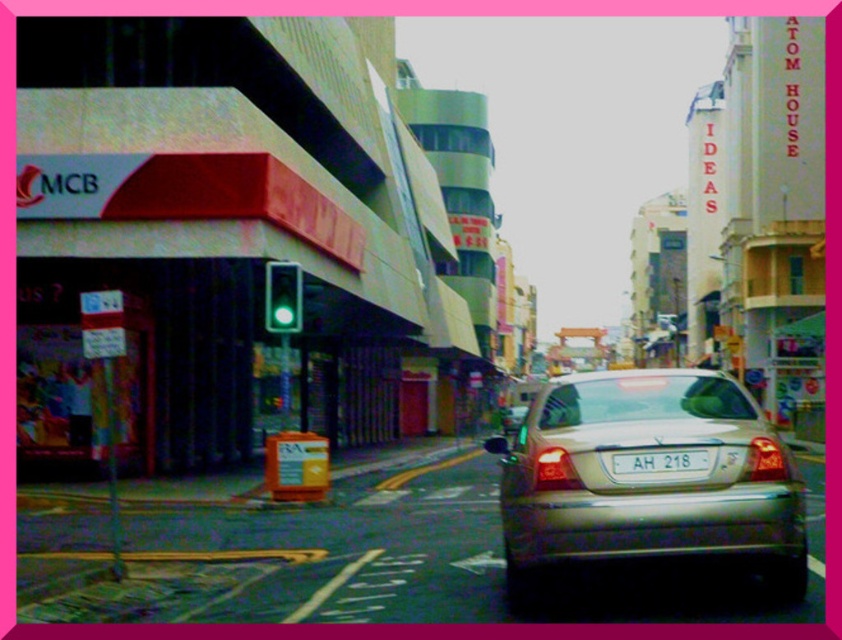
Question: Is silver metallic car at center below white plastic license plate at center?

Choices:
 (A) no
 (B) yes

Answer: (B)

Question: Is the position of silver metallic car at center less distant than that of white plastic license plate at center?

Choices:
 (A) no
 (B) yes

Answer: (B)

Question: Which point is farther from the camera taking this photo?

Choices:
 (A) (632, 376)
 (B) (270, 324)
 (C) (619, 474)

Answer: (B)

Question: Which point is closer to the camera?

Choices:
 (A) (784, 573)
 (B) (270, 317)
 (C) (681, 468)

Answer: (C)

Question: Can you confirm if silver metallic car at center is positioned to the right of white plastic license plate at center?

Choices:
 (A) no
 (B) yes

Answer: (A)

Question: Among these points, which one is nearest to the camera?

Choices:
 (A) (x=680, y=456)
 (B) (x=537, y=484)

Answer: (A)